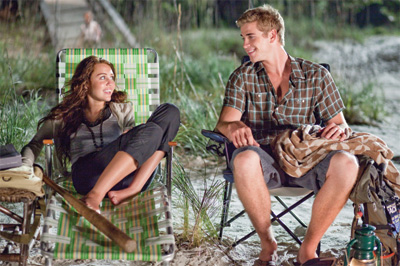
At what (x,y) coordinates should I click in order to perform the action: click on book. Please return your answer as a coordinate pair (x, y). The height and width of the screenshot is (266, 400). Looking at the image, I should click on (11, 158).